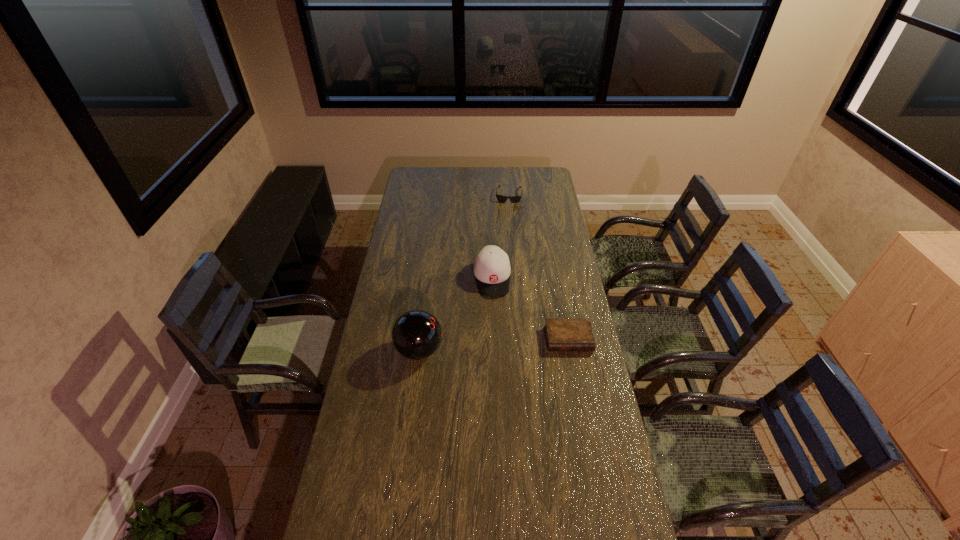
Find the location of a particular element. Image resolution: width=960 pixels, height=540 pixels. vacant region located on the front-facing side of the farthest object is located at coordinates (503, 247).

Where is `vacant space situated on the front-facing side of the second tallest object`? Image resolution: width=960 pixels, height=540 pixels. vacant space situated on the front-facing side of the second tallest object is located at coordinates (495, 317).

This screenshot has height=540, width=960. In order to click on free space located 0.160m on the front-facing side of the second tallest object in this screenshot , I will do `click(496, 326)`.

Locate an element on the screen. This screenshot has width=960, height=540. free space located 0.400m on the front-facing side of the second tallest object is located at coordinates (502, 374).

This screenshot has width=960, height=540. I want to click on object situated at the far edge, so click(514, 199).

Find the location of `object present at the left edge`. object present at the left edge is located at coordinates (416, 334).

At what (x,y) coordinates should I click in order to perform the action: click on object at the right edge. Please return your answer as a coordinate pair (x, y). This screenshot has width=960, height=540. Looking at the image, I should click on (562, 334).

In the image, there is a desktop. Identify the location of free region at the left edge. (405, 311).

This screenshot has height=540, width=960. In the image, there is a desktop. What are the coordinates of `free space at the right edge` in the screenshot? It's located at (553, 210).

Find the location of a particular element. This screenshot has width=960, height=540. free region at the far right corner of the desktop is located at coordinates (530, 171).